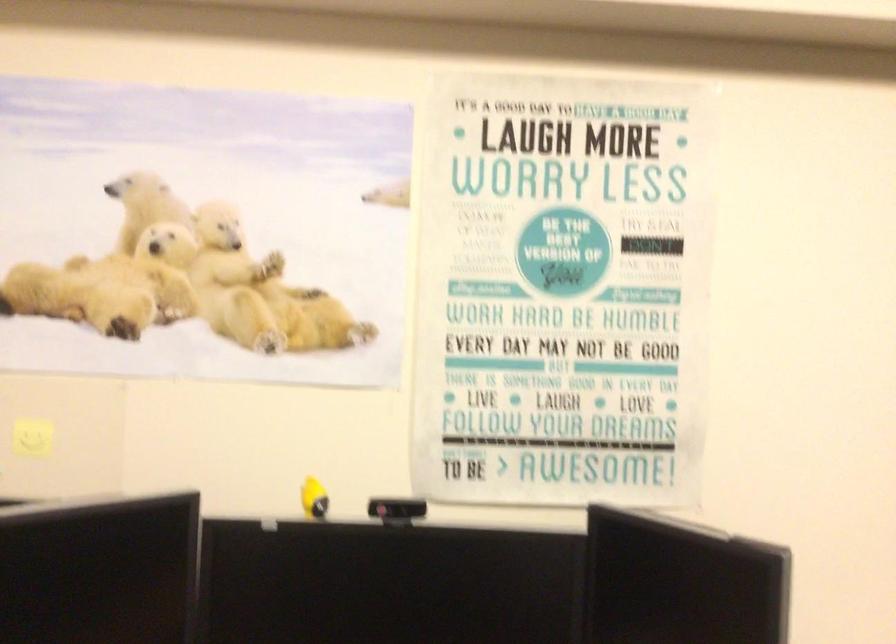
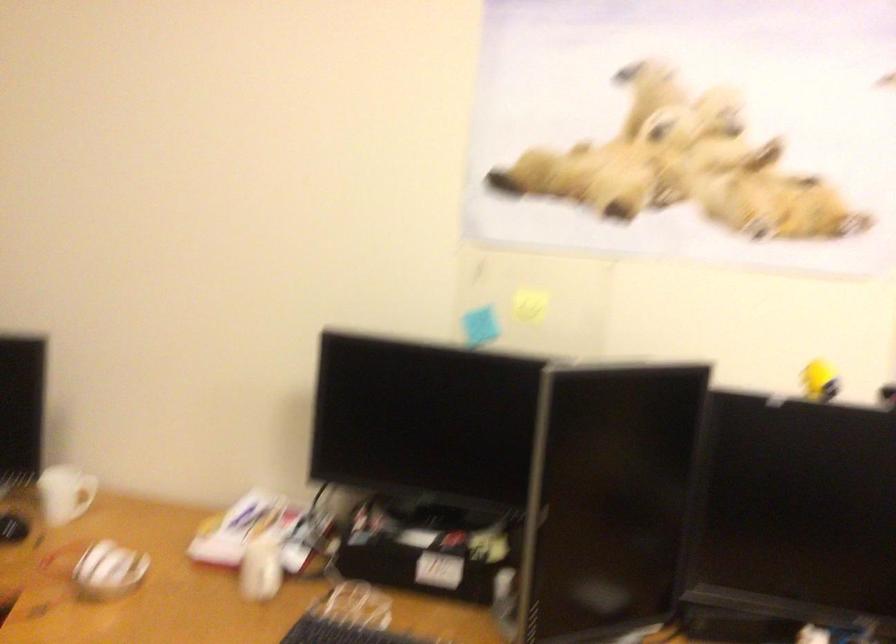
The images are taken continuously from a first-person perspective. In which direction are you moving?

The cameraman walked toward left, backward.